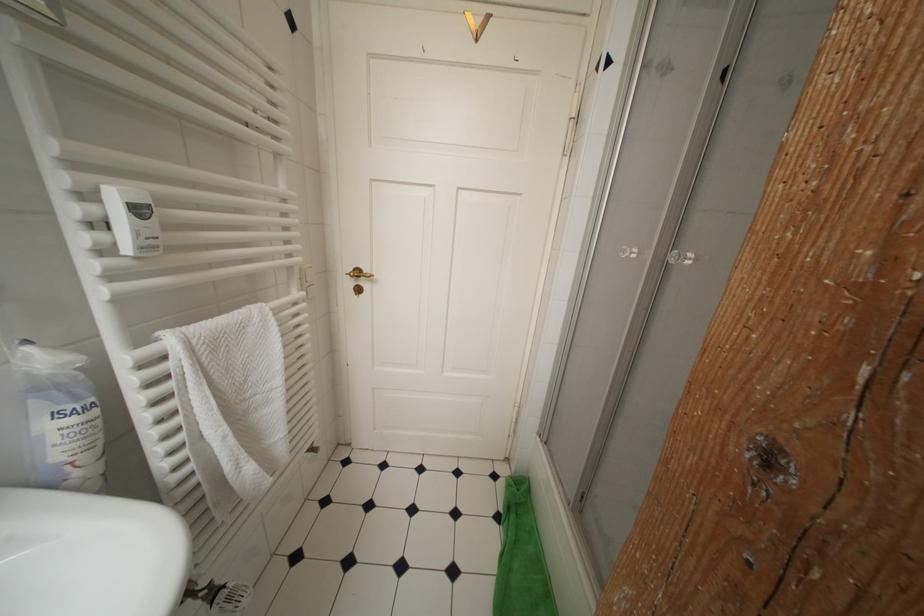
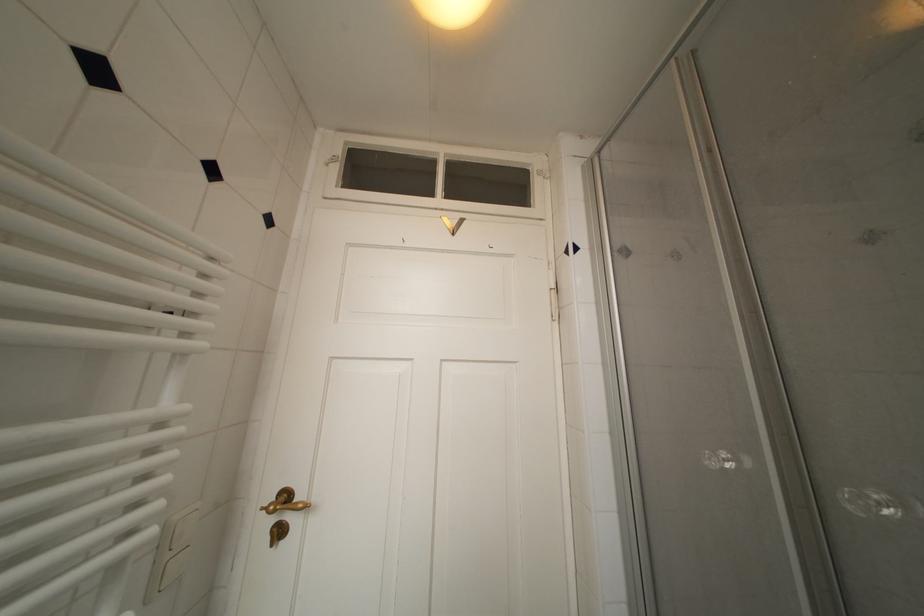
Question: I am providing you with two images of the same scene from different viewpoints. Please identify which objects are invisible in image2.

Choices:
 (A) brass door handle
 (B) shower door handle
 (C) brass door lock
 (D) none of these

Answer: (D)